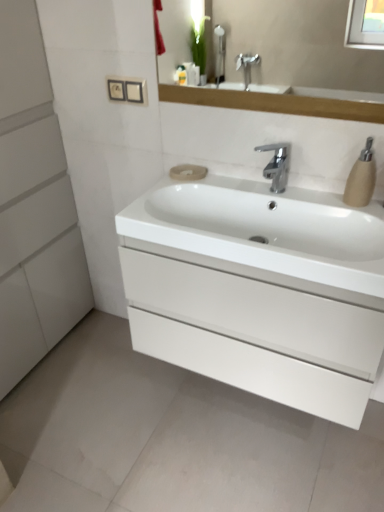
Measure the distance between point (219, 273) and camera.

The distance of point (219, 273) from camera is 4.01 feet.

In order to face beige matte soap dispenser at right, should I rotate leftwards or rightwards?

To face it directly, rotate right by 21.683 degrees.

Identify the location of beige matte soap at center. (188, 172).

Identify the location of white glossy drawer at center. This screenshot has height=512, width=384. (257, 312).

Which object is closer to the camera taking this photo, white glossy sink at center or polished chrome faucet at center?

white glossy sink at center is more forward.

Does white glossy sink at center turn towards polished chrome faucet at center?

No, white glossy sink at center is not facing towards polished chrome faucet at center.

The image size is (384, 512). Find the location of `tap above the white glossy sink at center (from the image's perspective)`. tap above the white glossy sink at center (from the image's perspective) is located at coordinates (277, 165).

How different are the orientations of polished chrome faucet at center and white matte cabinet at left in degrees?

90.1 degrees.

Which object is positioned more to the right, polished chrome faucet at center or white matte cabinet at left?

Positioned to the right is polished chrome faucet at center.

Is polished chrome faucet at center in front of or behind white matte cabinet at left in the image?

Clearly, polished chrome faucet at center is behind white matte cabinet at left.

Is polished chrome faucet at center placed right next to white matte cabinet at left?

polished chrome faucet at center and white matte cabinet at left are not in contact.

From the image's perspective, is polished chrome faucet at center located beneath beige matte soap dispenser at right?

No, from the image's perspective, polished chrome faucet at center is not beneath beige matte soap dispenser at right.

Is polished chrome faucet at center facing towards beige matte soap dispenser at right?

No.

Who is bigger, polished chrome faucet at center or beige matte soap dispenser at right?

polished chrome faucet at center.

Does polished chrome faucet at center have a lesser height compared to beige matte soap dispenser at right?

Yes.

Is point (360, 164) positioned before point (340, 324)?

No, it is behind (340, 324).

Can you confirm if beige matte soap dispenser at right is bigger than white glossy drawer at center?

No.

Measure the distance between beige matte soap dispenser at right and white glossy drawer at center.

beige matte soap dispenser at right is 18.35 inches from white glossy drawer at center.

Choose the correct answer: Is beige matte soap dispenser at right inside white glossy drawer at center or outside it?

beige matte soap dispenser at right lies outside white glossy drawer at center.

Considering the sizes of objects white glossy sink at center and white matte cabinet at left in the image provided, who is shorter, white glossy sink at center or white matte cabinet at left?

white glossy sink at center is shorter.

From a real-world perspective, which is physically above, white glossy sink at center or white matte cabinet at left?

white glossy sink at center is physically above.

Considering the sizes of objects white glossy sink at center and white matte cabinet at left in the image provided, who is thinner, white glossy sink at center or white matte cabinet at left?

Thinner between the two is white glossy sink at center.

You are a GUI agent. You are given a task and a screenshot of the screen. Output one action in this format:
    pyautogui.click(x=<x>, y=<y>)
    Task: Click on the sink below the white matte cabinet at left (from the image's perspective)
    Image resolution: width=384 pixels, height=512 pixels.
    Given the screenshot: What is the action you would take?
    pyautogui.click(x=264, y=234)

From the image's perspective, which one is positioned lower, polished chrome faucet at center or white glossy sink at center?

white glossy sink at center, from the image's perspective.

From a real-world perspective, is polished chrome faucet at center physically located above or below white glossy sink at center?

Clearly, from a real-world perspective, polished chrome faucet at center is above white glossy sink at center.

Can you confirm if polished chrome faucet at center is bigger than white glossy sink at center?

No, polished chrome faucet at center is not bigger than white glossy sink at center.

Is white matte cabinet at left not within beige matte soap dispenser at right?

Indeed, white matte cabinet at left is completely outside beige matte soap dispenser at right.

Is white matte cabinet at left taller or shorter than beige matte soap dispenser at right?

Clearly, white matte cabinet at left is taller compared to beige matte soap dispenser at right.

Are white matte cabinet at left and beige matte soap dispenser at right beside each other?

No, white matte cabinet at left is not making contact with beige matte soap dispenser at right.

How different are the orientations of white matte cabinet at left and beige matte soap dispenser at right in degrees?

white matte cabinet at left and beige matte soap dispenser at right are facing 90.1 degrees away from each other.

At what (x,y) coordinates should I click in order to perform the action: click on sink below the polished chrome faucet at center (from the image's perspective). Please return your answer as a coordinate pair (x, y). Image resolution: width=384 pixels, height=512 pixels. Looking at the image, I should click on (264, 234).

Where is `tap on the right of white matte cabinet at left`? This screenshot has height=512, width=384. tap on the right of white matte cabinet at left is located at coordinates (277, 165).

Considering their positions, is polished chrome faucet at center positioned further to beige matte soap dispenser at right than white matte cabinet at left?

white matte cabinet at left.

Considering their positions, is beige matte soap at center positioned further to beige matte soap dispenser at right than white glossy sink at center?

beige matte soap at center lies further to beige matte soap dispenser at right than the other object.

Considering their positions, is white glossy sink at center positioned closer to beige matte soap dispenser at right than white glossy drawer at center?

white glossy sink at center is positioned closer to the anchor beige matte soap dispenser at right.

Based on their spatial positions, is polished chrome faucet at center or white glossy sink at center further from beige matte soap dispenser at right?

white glossy sink at center is further to beige matte soap dispenser at right.

Based on their spatial positions, is white glossy drawer at center or white matte cabinet at left further from beige matte soap dispenser at right?

white matte cabinet at left lies further to beige matte soap dispenser at right than the other object.

From the image, which object appears to be nearer to white glossy drawer at center, beige matte soap at center or beige matte soap dispenser at right?

The object closer to white glossy drawer at center is beige matte soap dispenser at right.

When comparing their distances from white matte cabinet at left, does polished chrome faucet at center or white glossy drawer at center seem further?

Based on the image, polished chrome faucet at center appears to be further to white matte cabinet at left.

Looking at the image, which one is located further to white glossy drawer at center, white glossy sink at center or beige matte soap dispenser at right?

Among the two, beige matte soap dispenser at right is located further to white glossy drawer at center.

Image resolution: width=384 pixels, height=512 pixels. What are the coordinates of `tap between white glossy sink at center and beige matte soap dispenser at right` in the screenshot? It's located at (277, 165).

In order to click on drawer between beige matte soap at center and beige matte soap dispenser at right in this screenshot , I will do `click(257, 312)`.

Where is `tap between white matte cabinet at left and beige matte soap dispenser at right`? tap between white matte cabinet at left and beige matte soap dispenser at right is located at coordinates (277, 165).

The height and width of the screenshot is (512, 384). In order to click on sink between polished chrome faucet at center and white glossy drawer at center in the vertical direction in this screenshot , I will do `click(264, 234)`.